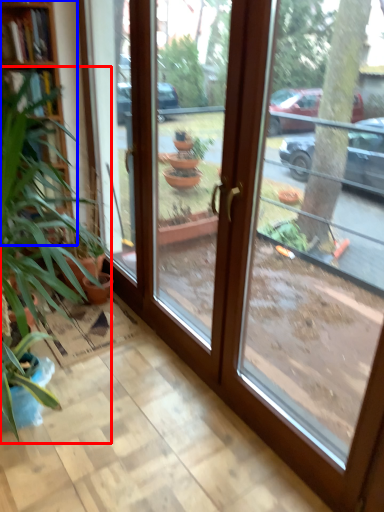
Question: Which point is closer to the camera, houseplant (highlighted by a red box) or bookshelf (highlighted by a blue box)?

Choices:
 (A) houseplant
 (B) bookshelf

Answer: (A)